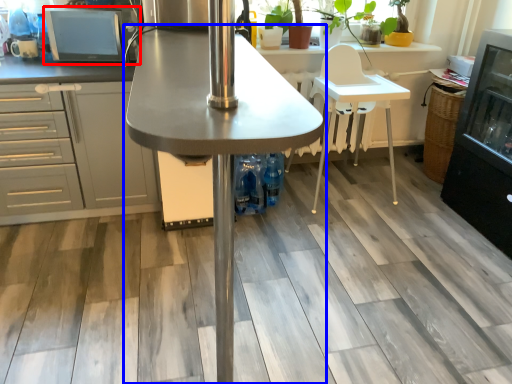
Question: Which point is closer to the camera, appliance (highlighted by a red box) or table (highlighted by a blue box)?

Choices:
 (A) appliance
 (B) table

Answer: (B)